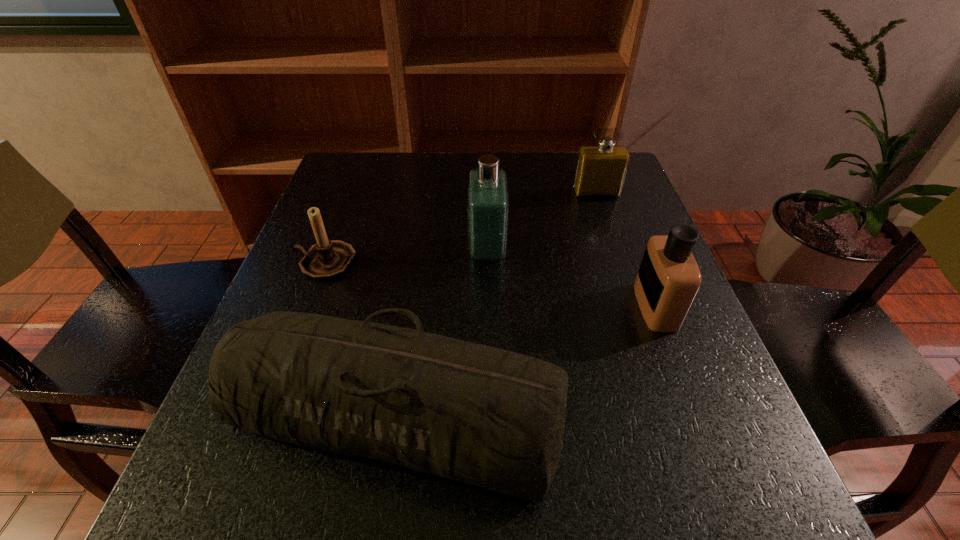
Identify the location of free point between the farthest perfume and the second nearest perfume. (541, 222).

Where is `vacant point located between the second nearest perfume and the candle holder`? vacant point located between the second nearest perfume and the candle holder is located at coordinates (406, 256).

Locate an element on the screen. The height and width of the screenshot is (540, 960). vacant region between the farthest perfume and the tallest object is located at coordinates (541, 222).

Where is `free area in between the nearest object and the farthest perfume`? free area in between the nearest object and the farthest perfume is located at coordinates (495, 303).

Image resolution: width=960 pixels, height=540 pixels. Find the location of `free space between the nearest object and the farthest object`. free space between the nearest object and the farthest object is located at coordinates [x=495, y=303].

Identify the location of free space between the duffel bag and the farthest object. (495, 303).

Choose which object is the nearest neighbor to the candle holder. Please provide its 2D coordinates. Your answer should be formatted as a tuple, i.e. [(x, y)], where the tuple contains the x and y coordinates of a point satisfying the conditions above.

[(492, 418)]

The height and width of the screenshot is (540, 960). Find the location of `object that is the closest one to the farthest perfume`. object that is the closest one to the farthest perfume is located at coordinates (488, 200).

Identify the location of perfume that stands as the third closest to the nearest object. The height and width of the screenshot is (540, 960). (601, 169).

Identify which perfume is located as the third nearest to the candle holder. Please provide its 2D coordinates. Your answer should be formatted as a tuple, i.e. [(x, y)], where the tuple contains the x and y coordinates of a point satisfying the conditions above.

[(668, 279)]